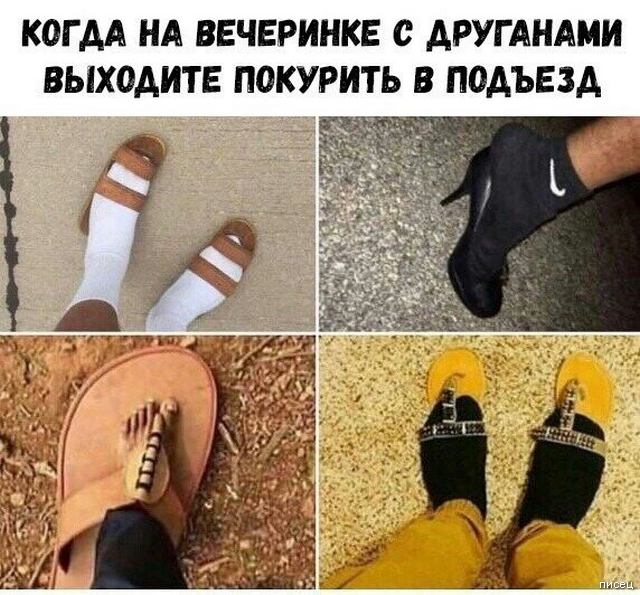
Identify the location of sock. The image size is (640, 595). (560, 459), (457, 444), (96, 239), (200, 297), (515, 198).